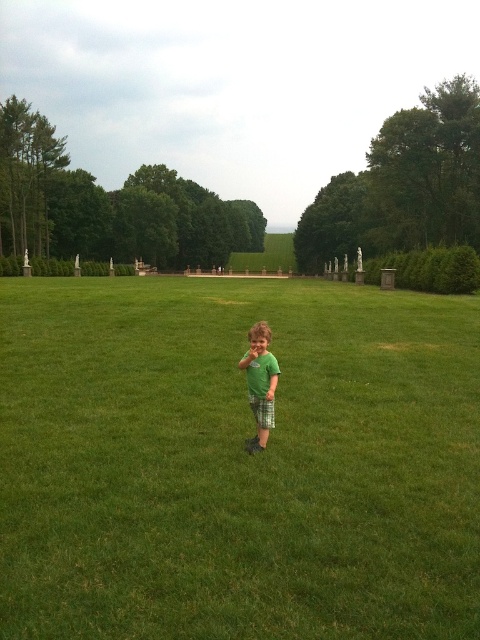
You are a photographer planning to capture a full body shot of the child wearing the green matte shirt at center while ensuring the green grass at center fills most of the background. Given the size difference between them, which object should you focus on to ensure proper focus and framing?

The green grass at center has a larger size compared to the green matte shirt at center. To ensure proper focus and framing for the full body shot, you should focus on the green matte shirt at center since it is smaller and closer to the camera, while the larger green grass at center will naturally fill the background.

You are a photographer trying to capture a photo of the green grass at center and the green matte shirt at center in the same frame. The camera you are using has a maximum focus range of 13 meters. Will both objects be in focus?

The green grass at center and green matte shirt at center are 13.55 meters apart from each other. Since the camera can only focus up to 13 meters, the distance between them exceeds the camera limit. Therefore, both objects cannot be in focus simultaneously.

You are a photographer trying to capture the child in the scene. Since the green grass at center and the green matte shirt at center are both green, how can you ensure the child stands out in the photo?

The green grass at center is closer to the viewer than the green matte shirt at center, so adjusting the focus to the green matte shirt at center will make the child stand out against the background.